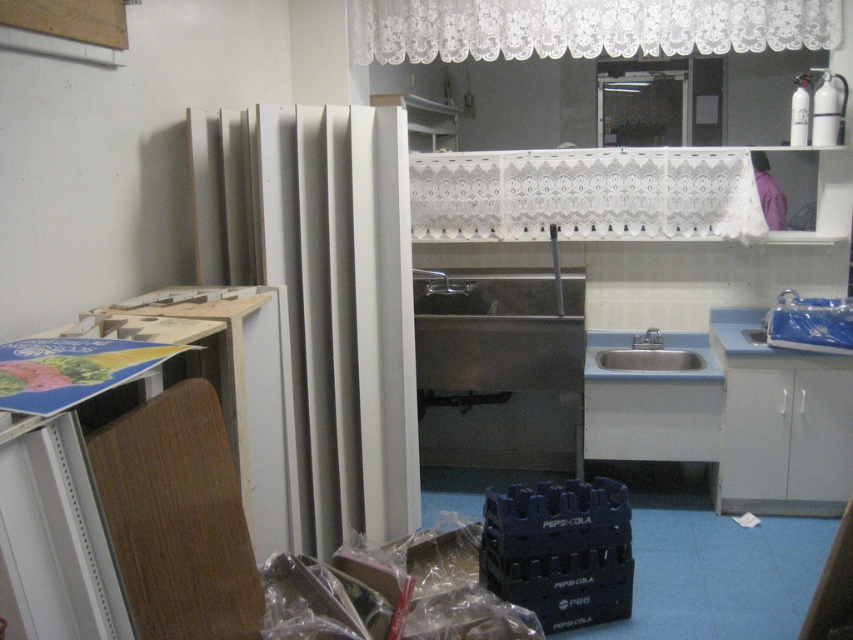
Question: Can you confirm if white lace curtain at upper center is positioned below satin silver sink at center?

Choices:
 (A) yes
 (B) no

Answer: (B)

Question: Which object is farther from the camera taking this photo?

Choices:
 (A) satin silver sink at center
 (B) white lace curtain at upper center

Answer: (A)

Question: Which object appears closest to the camera in this image?

Choices:
 (A) satin silver sink at center
 (B) white lace curtain at upper center

Answer: (B)

Question: Where is white lace curtain at upper center located in relation to satin silver sink at center in the image?

Choices:
 (A) above
 (B) below

Answer: (A)

Question: Does white lace curtain at upper center appear on the left side of satin silver sink at center?

Choices:
 (A) no
 (B) yes

Answer: (B)